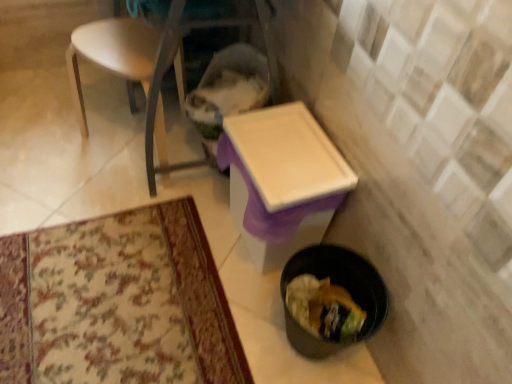
Find the location of a particular element. This screenshot has height=384, width=512. free space in front of white plastic chair at upper left is located at coordinates (109, 221).